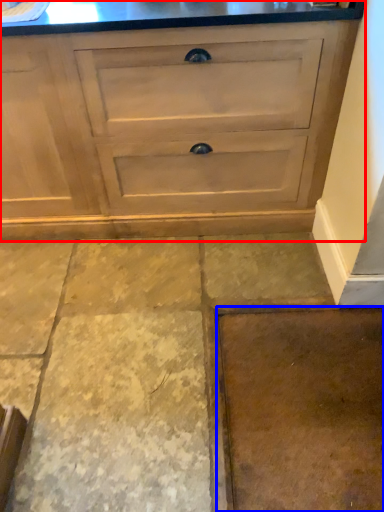
Question: Which point is closer to the camera, chest of drawers (highlighted by a red box) or concrete (highlighted by a blue box)?

Choices:
 (A) chest of drawers
 (B) concrete

Answer: (B)